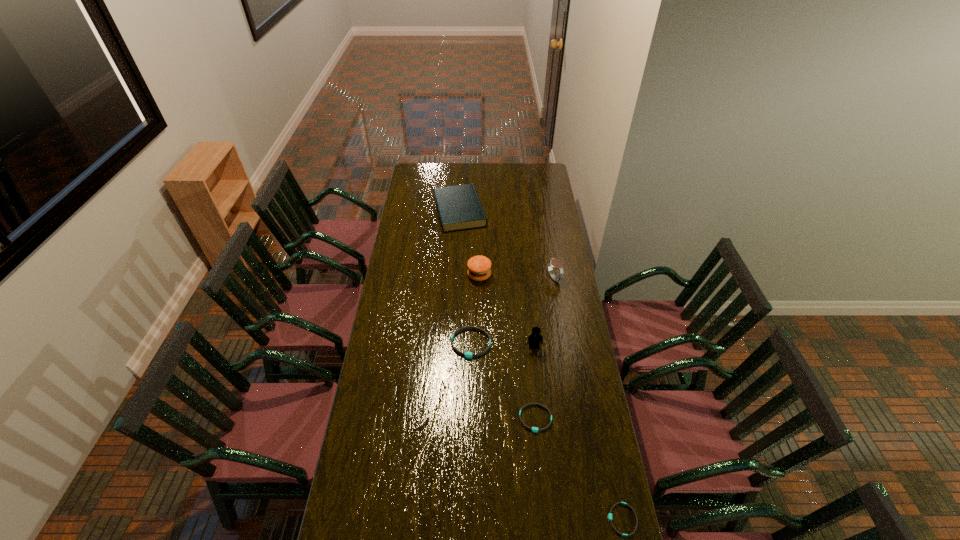
Locate an element on the screen. vacant place for an extra wristband on the left is located at coordinates (421, 286).